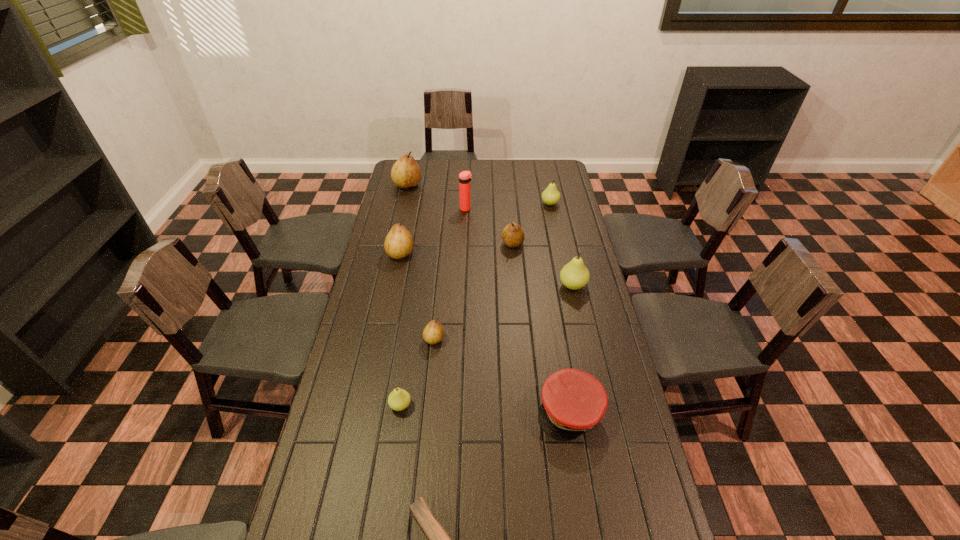
I want to click on the fourth pear from right to left, so click(433, 333).

The image size is (960, 540). What are the coordinates of `the smallest brown pear` in the screenshot? It's located at (433, 333).

What are the coordinates of `the leftmost green pear` in the screenshot? It's located at (399, 399).

Identify the location of the nearest pear. (399, 399).

Where is `cap`? The image size is (960, 540). cap is located at coordinates (574, 401).

Locate an element on the screen. This screenshot has height=540, width=960. vacant space situated on the right of the farthest pear is located at coordinates (489, 185).

You are a GUI agent. You are given a task and a screenshot of the screen. Output one action in this format:
    pyautogui.click(x=<x>, y=<y>)
    Task: Click on the free location located on the left of the thermos bottle
    This screenshot has width=960, height=540.
    Given the screenshot: What is the action you would take?
    pyautogui.click(x=422, y=209)

Identify the location of vacant space located 0.360m on the back of the second biggest brown pear. The height and width of the screenshot is (540, 960). (412, 198).

What are the coordinates of `free location located on the front of the second farthest green pear` in the screenshot? It's located at (586, 342).

In order to click on vacant space located 0.360m on the left of the fifth pear from left to right in this screenshot , I will do `click(418, 244)`.